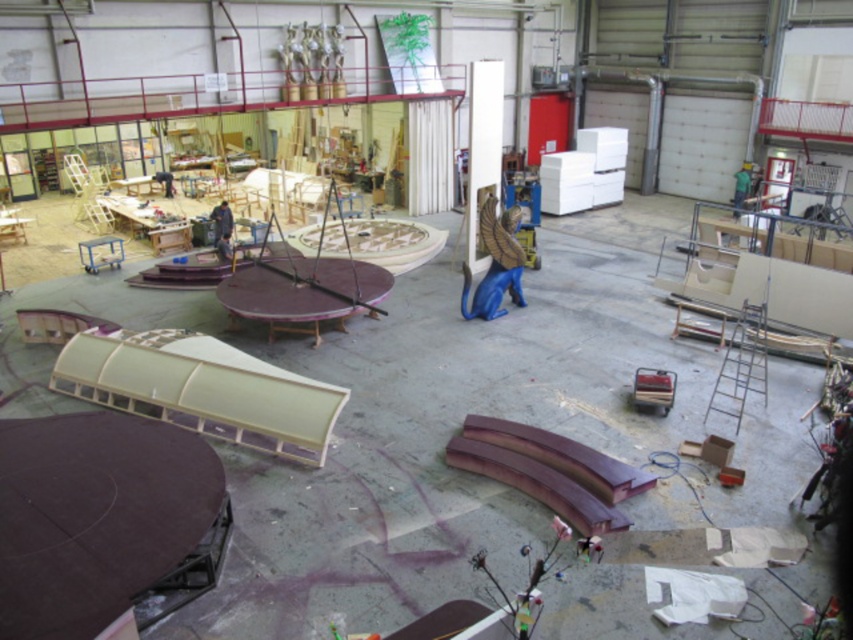
Can you confirm if blue fabric at center is positioned to the right of dark blue fabric at center?

Correct, you'll find blue fabric at center to the right of dark blue fabric at center.

Who is more forward, (225, 205) or (160, 173)?

Point (225, 205) is more forward.

Image resolution: width=853 pixels, height=640 pixels. In order to click on blue fabric at center in this screenshot , I will do point(221,221).

How much distance is there between blue matte statue at center and green fabric person at upper right?

They are 10.51 meters apart.

Which is in front, point (515, 244) or point (735, 188)?

Point (515, 244)

Locate an element on the screen. The width and height of the screenshot is (853, 640). blue matte statue at center is located at coordinates (495, 262).

Is blue matte statue at center further to the viewer compared to blue fabric at center?

No, it is in front of blue fabric at center.

Does blue matte statue at center have a greater width compared to blue fabric at center?

Yes, blue matte statue at center is wider than blue fabric at center.

Between point (508, 269) and point (225, 200), which one is positioned behind?

Positioned behind is point (225, 200).

You are a GUI agent. You are given a task and a screenshot of the screen. Output one action in this format:
    pyautogui.click(x=<x>, y=<y>)
    Task: Click on the blue matte statue at center
    The height and width of the screenshot is (640, 853).
    Given the screenshot: What is the action you would take?
    pyautogui.click(x=495, y=262)